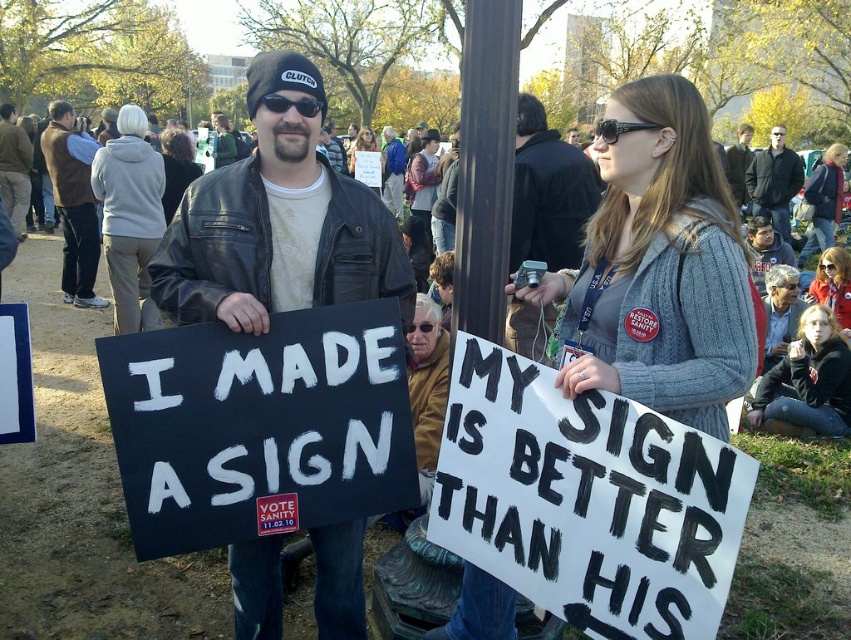
Question: Does gray knitted sweater at upper center appear under matte gray sweater at center?

Choices:
 (A) no
 (B) yes

Answer: (B)

Question: Can you confirm if matte black leather jacket at center is thinner than light gray hoodie at upper left?

Choices:
 (A) yes
 (B) no

Answer: (B)

Question: Which point is closer to the camera taking this photo?

Choices:
 (A) (373, 138)
 (B) (175, 208)

Answer: (B)

Question: Estimate the real-world distances between objects in this image. Which object is closer to the denim jacket at upper center?

Choices:
 (A) matte black leather jacket at center
 (B) brown leather jacket at left
 (C) brown suede vest at left

Answer: (C)

Question: Which point is farther from the camera taking this photo?

Choices:
 (A) (163, 176)
 (B) (654, 403)
 (C) (387, 128)
 (D) (823, 256)

Answer: (C)

Question: Can you confirm if brown leather jacket at left is positioned to the left of dark brown hair at center?

Choices:
 (A) yes
 (B) no

Answer: (A)